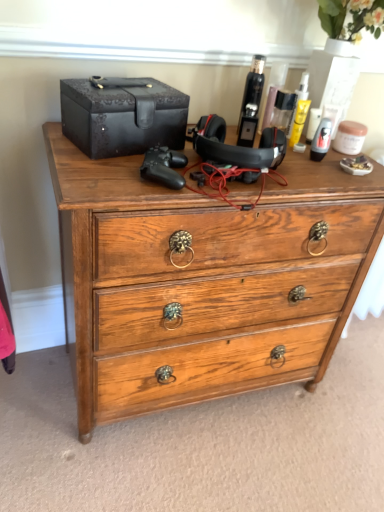
Question: Does wooden chest of drawers at center have a greater height compared to black leather box at upper left?

Choices:
 (A) no
 (B) yes

Answer: (B)

Question: Is wooden chest of drawers at center outside of black leather box at upper left?

Choices:
 (A) yes
 (B) no

Answer: (A)

Question: Does wooden chest of drawers at center have a lesser height compared to black leather box at upper left?

Choices:
 (A) yes
 (B) no

Answer: (B)

Question: Is wooden chest of drawers at center further to camera compared to black leather box at upper left?

Choices:
 (A) yes
 (B) no

Answer: (B)

Question: From the image's perspective, is wooden chest of drawers at center above black leather box at upper left?

Choices:
 (A) no
 (B) yes

Answer: (A)

Question: Does wooden chest of drawers at center turn towards black leather box at upper left?

Choices:
 (A) no
 (B) yes

Answer: (A)

Question: Does wooden chest of drawers at center lie behind shiny black bottle at upper right, the 2th toiletry positioned from the left?

Choices:
 (A) yes
 (B) no

Answer: (B)

Question: Can you confirm if wooden chest of drawers at center is positioned to the left of shiny black bottle at upper right, the 2th toiletry positioned from the left?

Choices:
 (A) yes
 (B) no

Answer: (A)

Question: From a real-world perspective, is wooden chest of drawers at center located higher than shiny black bottle at upper right, which is the 1th toiletry from right to left?

Choices:
 (A) no
 (B) yes

Answer: (A)

Question: Is wooden chest of drawers at center turned away from shiny black bottle at upper right, which is the 1th toiletry from right to left?

Choices:
 (A) yes
 (B) no

Answer: (B)

Question: Does wooden chest of drawers at center turn towards shiny black bottle at upper right, the 2th toiletry positioned from the left?

Choices:
 (A) yes
 (B) no

Answer: (B)

Question: Can you confirm if wooden chest of drawers at center is positioned to the right of shiny black bottle at upper right, which is the 1th toiletry from right to left?

Choices:
 (A) yes
 (B) no

Answer: (B)

Question: Is shiny black hair spray at upper center, which ranks as the 2th toiletry in right-to-left order, smaller than shiny black bottle at upper right, the 2th toiletry positioned from the left?

Choices:
 (A) no
 (B) yes

Answer: (A)